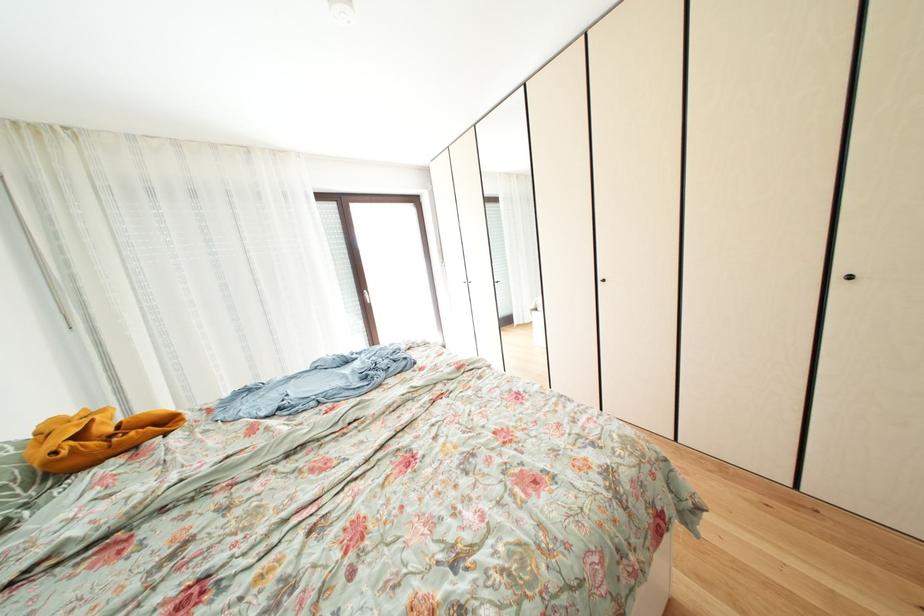
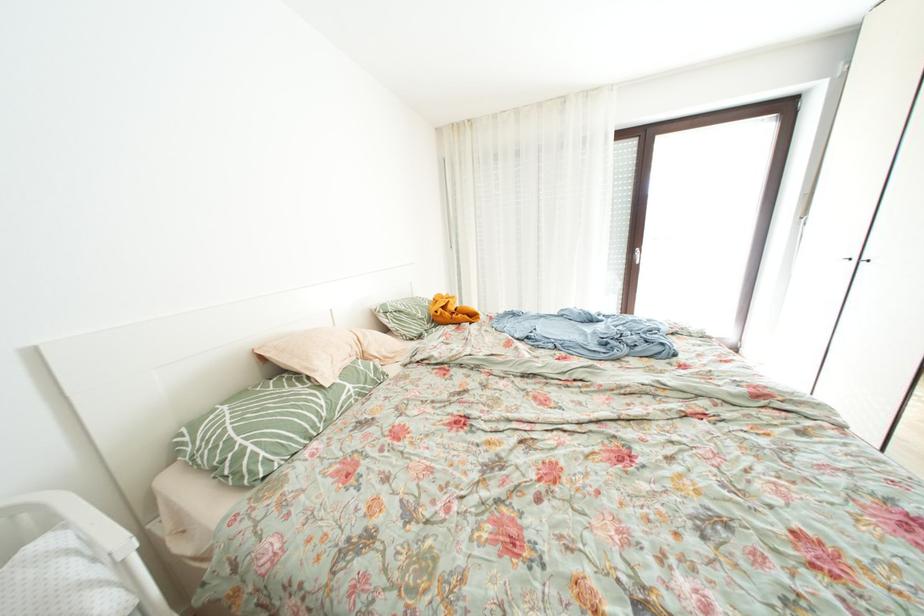
Based on the continuous images, in which direction is the camera rotating?

The camera rotated toward left-down.